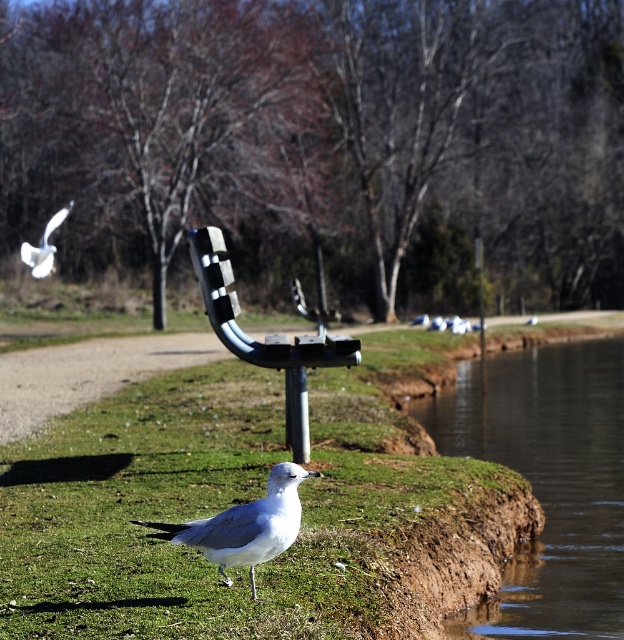
Is brown dirt at lower right below metallic pole at center?

Indeed, brown dirt at lower right is positioned under metallic pole at center.

Does brown dirt at lower right have a smaller size compared to metallic pole at center?

Correct, brown dirt at lower right occupies less space than metallic pole at center.

I want to click on brown dirt at lower right, so click(547, 483).

Describe the element at coordinates (245, 525) in the screenshot. I see `white matte bird at lower center` at that location.

Is white matte bird at lower center wider than white feathered bird at upper left?

In fact, white matte bird at lower center might be narrower than white feathered bird at upper left.

What do you see at coordinates (245, 525) in the screenshot? I see `white matte bird at lower center` at bounding box center [245, 525].

This screenshot has width=624, height=640. In order to click on white matte bird at lower center in this screenshot , I will do `click(245, 525)`.

How distant is green grass at lower center from white feathered bird at upper left?

green grass at lower center is 36.43 feet away from white feathered bird at upper left.

Is point (310, 616) farther from camera compared to point (41, 240)?

No.

Locate an element on the screen. The image size is (624, 640). green grass at lower center is located at coordinates (238, 504).